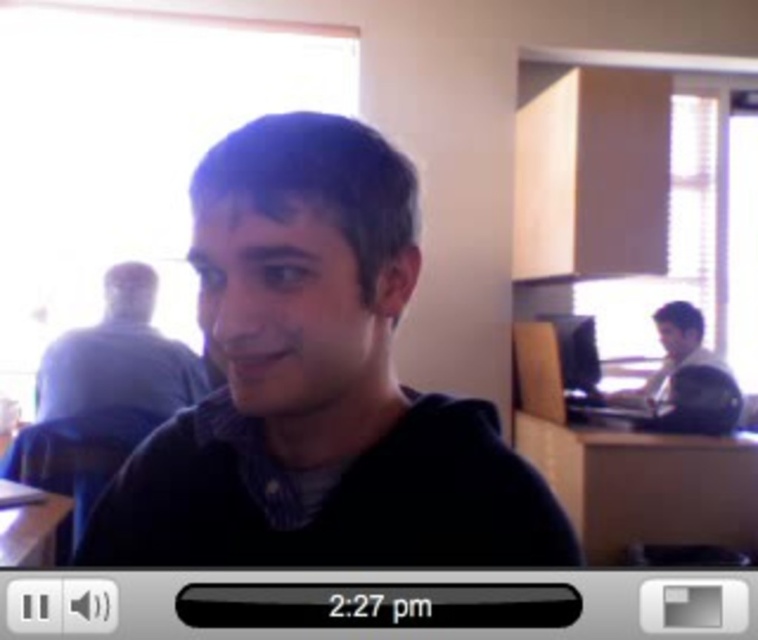
Question: Is light brown wooden desk at right bigger than wooden table at lower left?

Choices:
 (A) yes
 (B) no

Answer: (A)

Question: Which point is farther to the camera?

Choices:
 (A) (252, 189)
 (B) (36, 532)

Answer: (B)

Question: Does gray matte shirt at upper left appear under light brown wooden desk at right?

Choices:
 (A) no
 (B) yes

Answer: (A)

Question: Based on their relative distances, which object is farther from the gray matte shirt at upper left?

Choices:
 (A) wooden desk at center
 (B) wooden table at lower left
 (C) matte black monitor at right

Answer: (C)

Question: Does gray matte shirt at upper left have a larger size compared to matte black monitor at right?

Choices:
 (A) no
 (B) yes

Answer: (B)

Question: Which of the following is the farthest from the observer?

Choices:
 (A) (86, 376)
 (B) (280, 211)
 (C) (17, 493)
 (D) (666, 348)

Answer: (D)